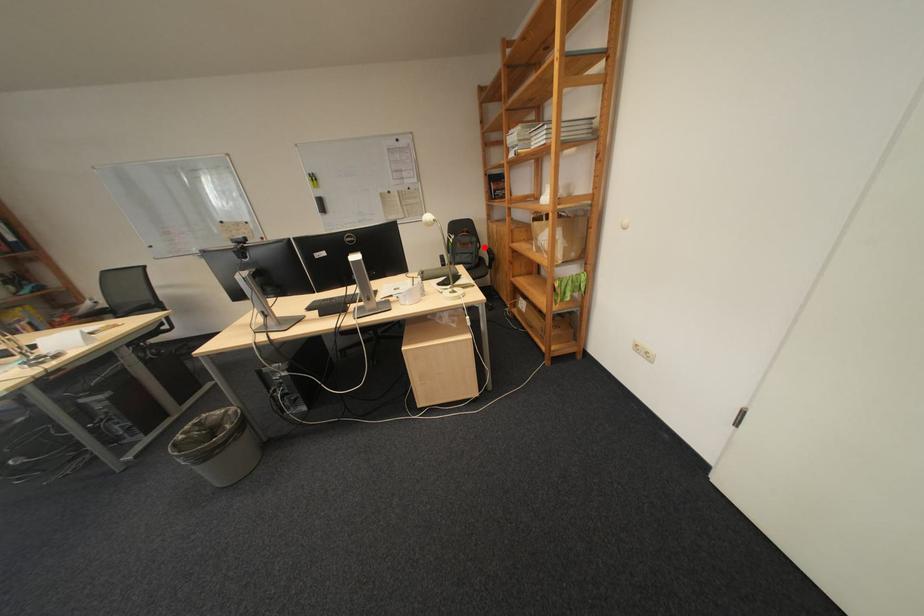
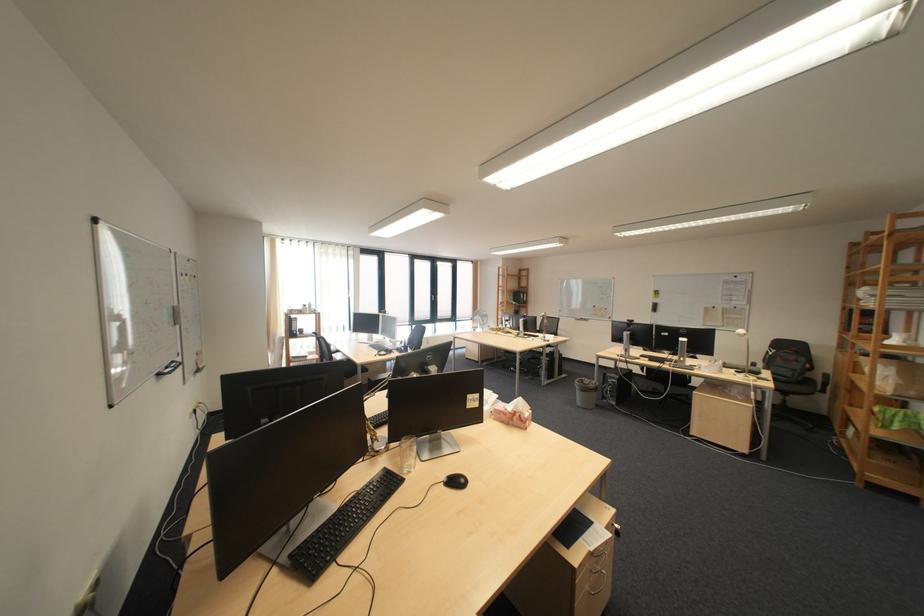
In the second image, find the point that corresponds to the highlighted location in the first image.

(808, 365)